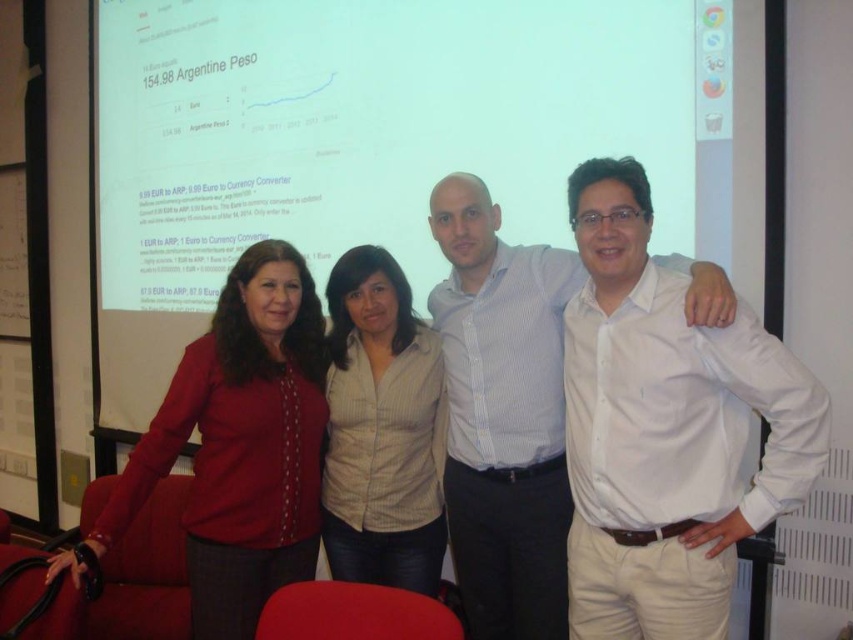
You are a photographer standing in the conference room. You need to position a 1 meter wide banner between the white cotton shirt at right and the white shirt at center. Can you fit it there?

The white cotton shirt at right might be wider than the white shirt at center, so the distance between them is uncertain. Without knowing the exact space, it is risky to place the banner there.

You are a photographer adjusting the lighting in the conference room. You have two white shirts in the frame, the white cotton shirt at right and the white shirt at center. Which one requires less adjustment to avoid overexposure since it reflects more light?

The white cotton shirt at right requires less adjustment to avoid overexposure since it is larger in size than the white shirt at center and thus reflects more light.

You are organizing a business meeting and need to seat the participants in order of their clothing width from widest to narrowest. Given the participants are wearing the white cotton shirt at right and the matte red blouse at left, which should be seated first?

The matte red blouse at left should be seated first since it has a wider width compared to the white cotton shirt at right.